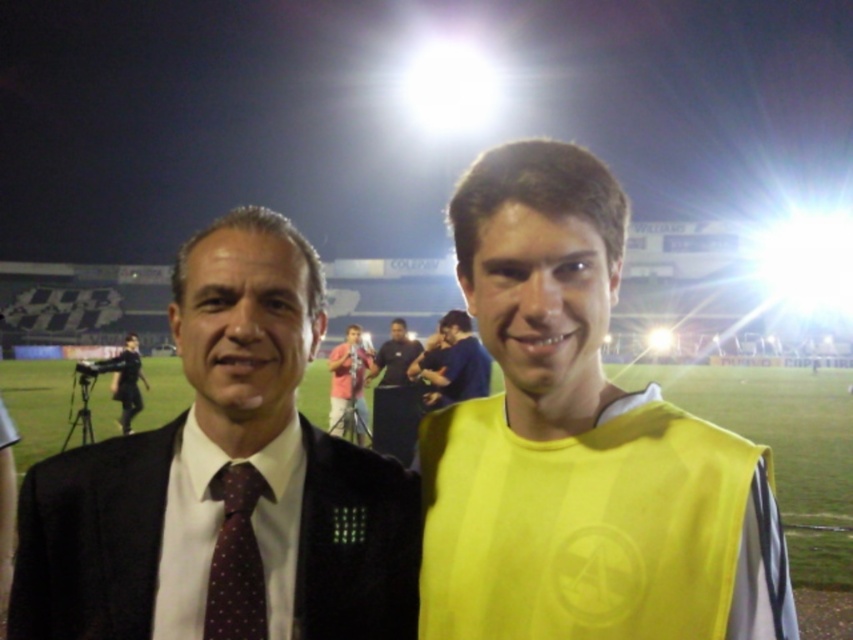
You are a photographer at the stadium and want to take a photo of the black fabric shirt at center and the yellow jersey at center. Which one will appear larger in the photo?

The black fabric shirt at center will appear larger in the photo because it is bigger than the yellow jersey at center.

You are a photographer standing in the middle of the stadium. You want to take a photo of both the black fabric shirt at center and the yellow jersey at center. If you want to ensure both are fully visible in the frame, which one should you focus on first?

You should focus on the black fabric shirt at center first since it might be wider than the yellow jersey at center, so ensuring it fits in the frame properly would be essential before adjusting for the other.

From the picture: You are standing at the origin of the coordinate system in the stadium. You see two points marked in the image. Which point is closer to you, point (387, 387) or point (132, 406)?

Point (387, 387) is in front of point (132, 406), so it is closer to you.